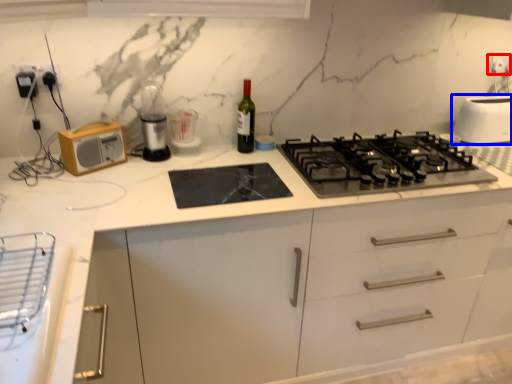
Question: Among these objects, which one is farthest to the camera, electric outlet (highlighted by a red box) or toaster (highlighted by a blue box)?

Choices:
 (A) electric outlet
 (B) toaster

Answer: (A)